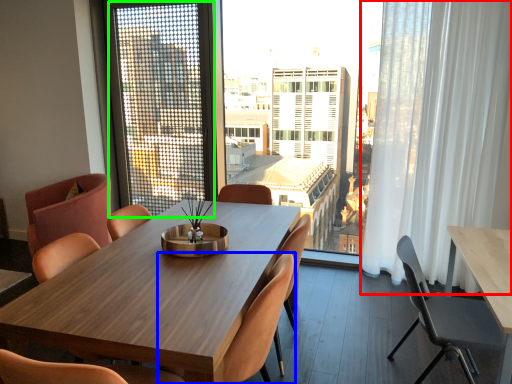
Question: Which object is positioned farthest from curtain (highlighted by a red box)? Select from chair (highlighted by a blue box) and screen door (highlighted by a green box).

Choices:
 (A) chair
 (B) screen door

Answer: (B)